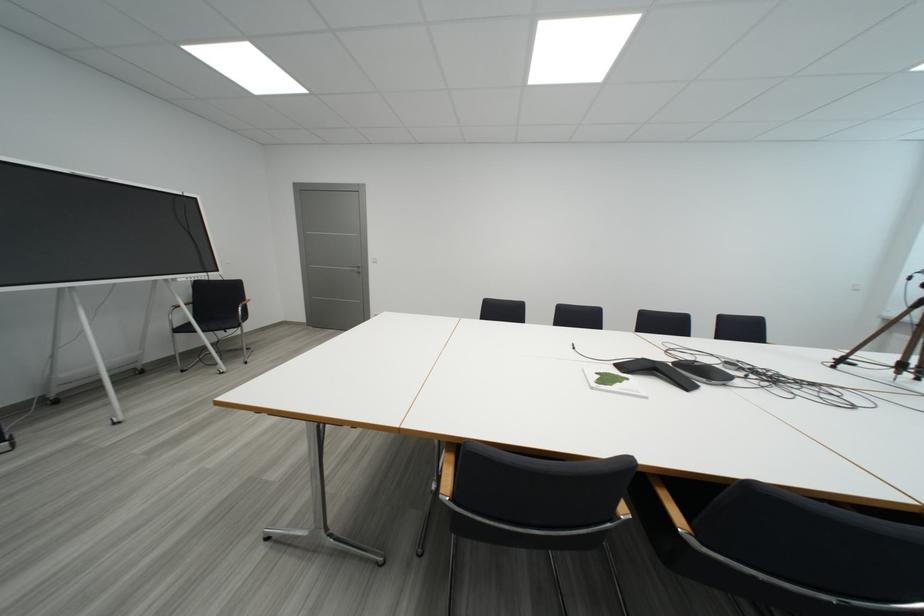
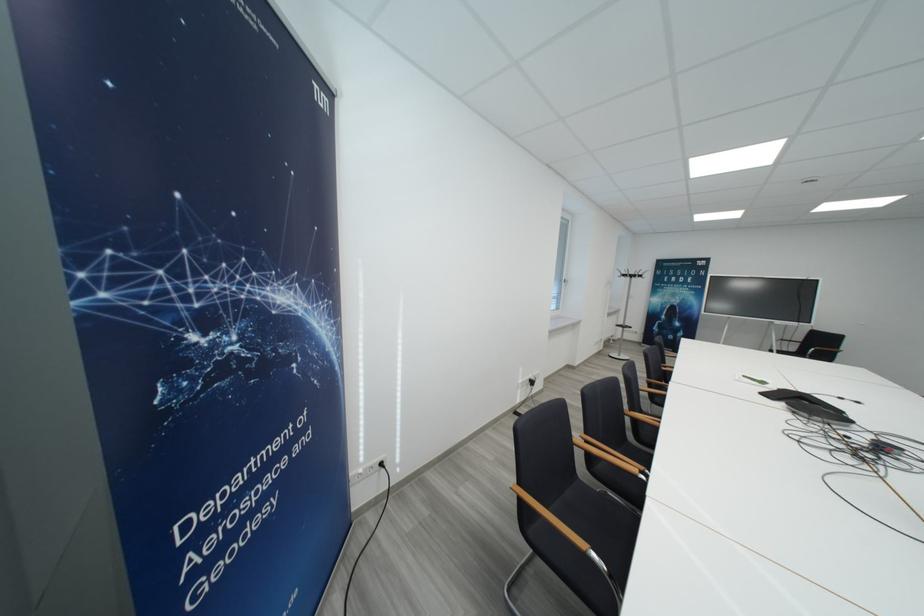
Question: I am providing you with two images of the same scene from different viewpoints. Which of the following objects are not visible in image2?

Choices:
 (A) coat rack hook
 (B) small green container
 (C) black chair sitting surface
 (D) wooden chair armrest

Answer: (D)